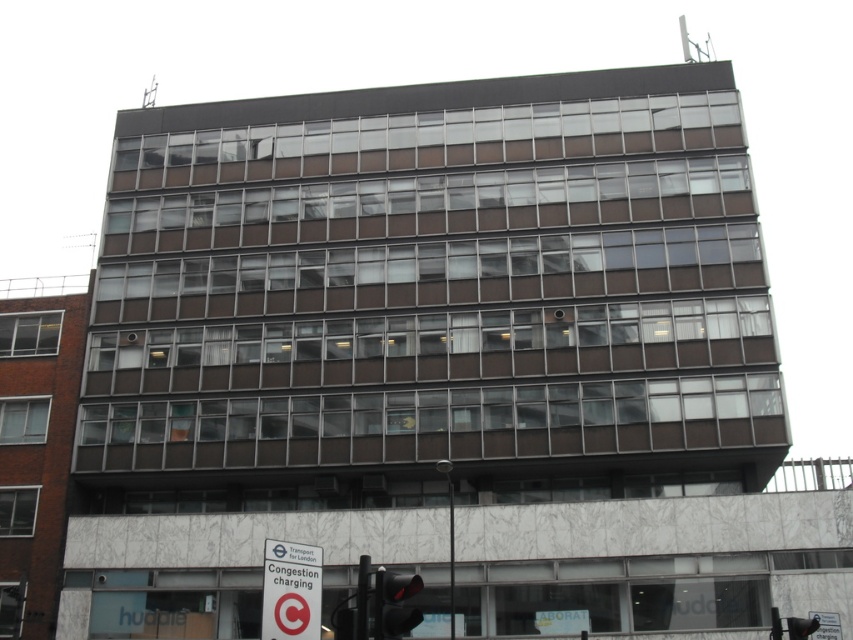
Question: Does white plastic sign at lower center have a lesser width compared to red glass traffic light at lower center?

Choices:
 (A) no
 (B) yes

Answer: (A)

Question: Which point is closer to the camera taking this photo?

Choices:
 (A) (376, 573)
 (B) (283, 547)

Answer: (A)

Question: Is white plastic sign at lower center positioned in front of red glass traffic light at lower center?

Choices:
 (A) yes
 (B) no

Answer: (B)

Question: Which point is farther to the camera?

Choices:
 (A) (409, 580)
 (B) (263, 561)

Answer: (B)

Question: Can you confirm if white plastic sign at lower center is positioned below red glass traffic light at lower center?

Choices:
 (A) yes
 (B) no

Answer: (A)